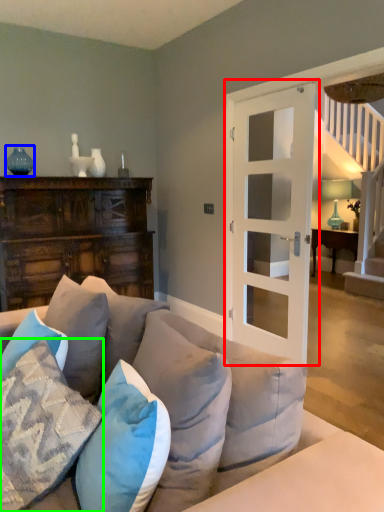
Question: Which is nearer to the door (highlighted by a red box)? teal (highlighted by a blue box) or pillow (highlighted by a green box).

Choices:
 (A) teal
 (B) pillow

Answer: (B)